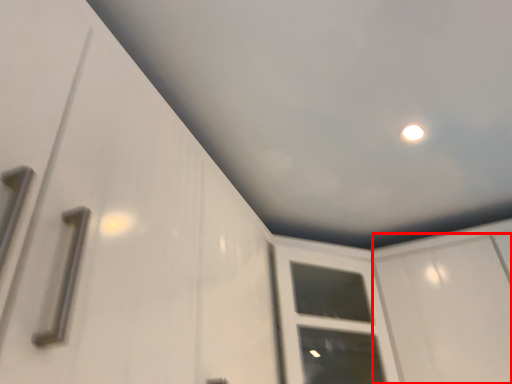
Question: From the image, what is the correct spatial relationship of screen door (annotated by the red box) in relation to window frame?

Choices:
 (A) left
 (B) right

Answer: (B)